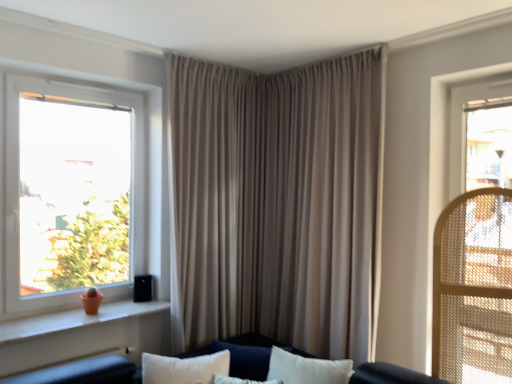
In order to click on empty space that is ontop of beige fabric curtain at center (from a real-world perspective) in this screenshot , I will do `click(315, 65)`.